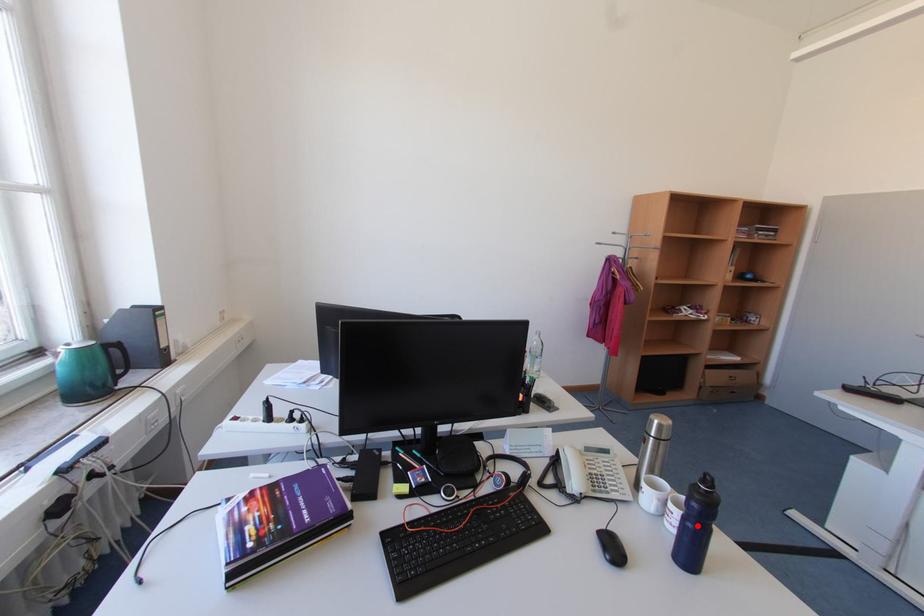
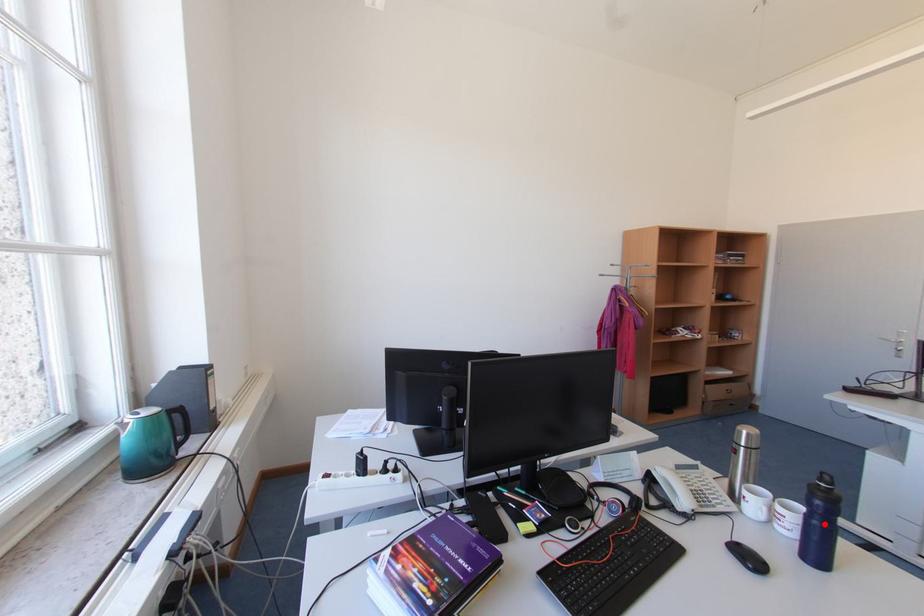
I am providing you with two images of the same scene from different viewpoints. A red point is marked on the first image and another point is marked on the second image. Do the highlighted points in image1 and image2 indicate the same real-world spot?

Yes